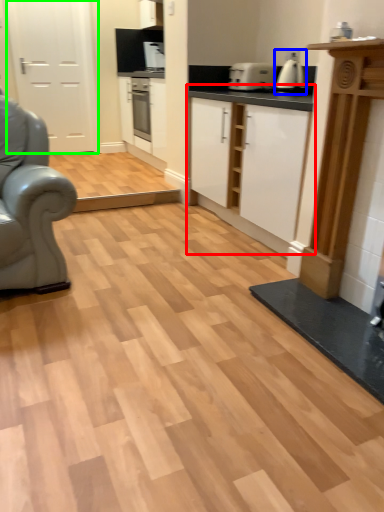
Question: Which object is the closest to the cabinetry (highlighted by a red box)? Choose among these: coffee machine (highlighted by a blue box) or door (highlighted by a green box).

Choices:
 (A) coffee machine
 (B) door

Answer: (A)